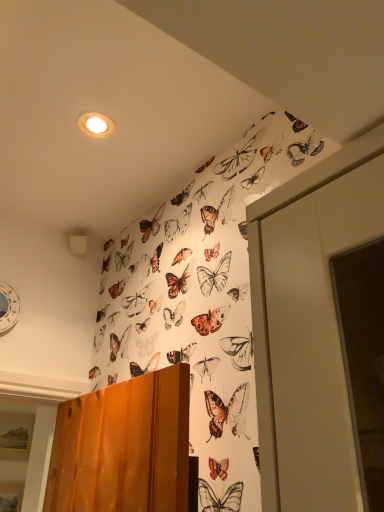
Question: Should I look upward or downward to see matte white light at upper center?

Choices:
 (A) up
 (B) down

Answer: (A)